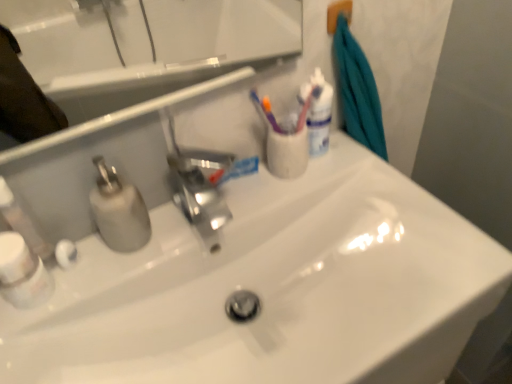
This screenshot has height=384, width=512. What are the coordinates of `vacant space in front of white glossy toothpaste at center` in the screenshot? It's located at (212, 223).